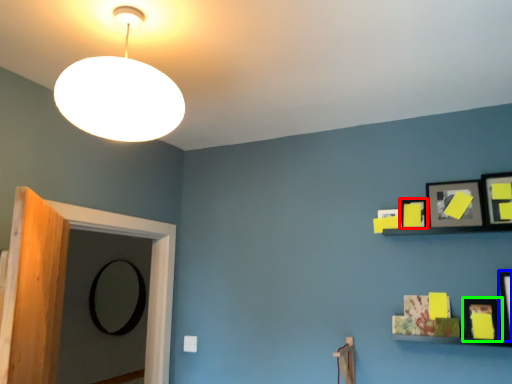
Question: Which object is positioned closest to picture frame (highlighted by a red box)? Select from picture frame (highlighted by a blue box) and picture frame (highlighted by a green box).

Choices:
 (A) picture frame
 (B) picture frame

Answer: (B)